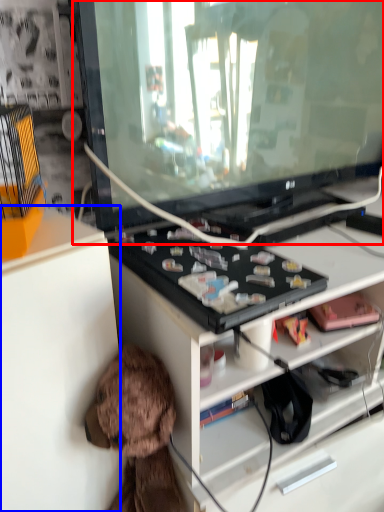
Question: Which of the following is the farthest to the observer, television (highlighted by a red box) or cabinetry (highlighted by a blue box)?

Choices:
 (A) television
 (B) cabinetry

Answer: (A)